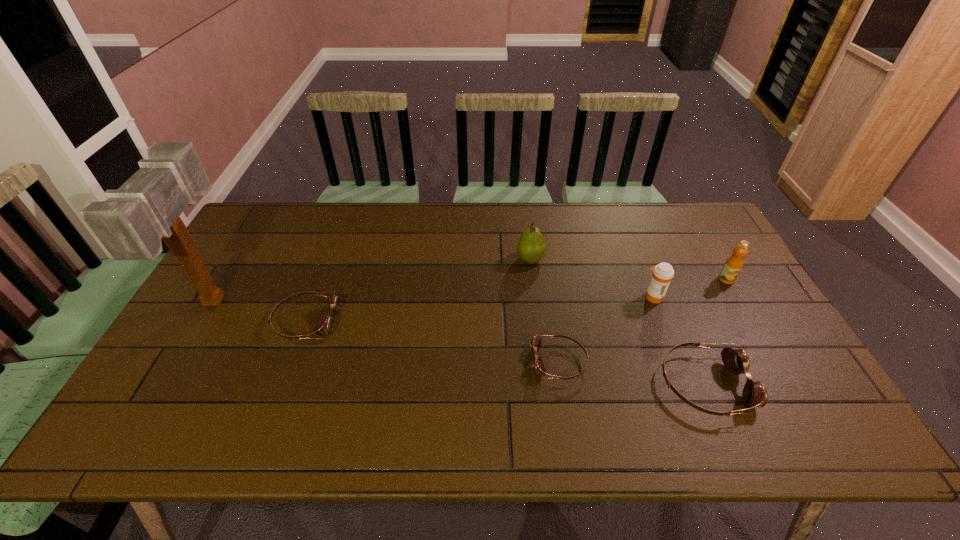
Identify the location of vacant area between the second tallest goggles and the mallet. The image size is (960, 540). (261, 310).

Locate an element on the screen. This screenshot has height=540, width=960. vacant region between the tallest object and the shortest object is located at coordinates (388, 331).

This screenshot has height=540, width=960. What are the coordinates of `vacant area that lies between the fifth tallest object and the pear` in the screenshot? It's located at (617, 322).

You are a GUI agent. You are given a task and a screenshot of the screen. Output one action in this format:
    pyautogui.click(x=<x>, y=<y>)
    Task: Click on the free spot between the orange juice and the tallest object
    
    Given the screenshot: What is the action you would take?
    pyautogui.click(x=471, y=290)

At what (x,y) coordinates should I click in order to perform the action: click on free space between the rightmost object and the medicine. Please return your answer as a coordinate pair (x, y). This screenshot has width=960, height=540. Looking at the image, I should click on (689, 288).

Identify the location of vacant point located between the second object from left to right and the pear. (419, 290).

At what (x,y) coordinates should I click in order to perform the action: click on unoccupied area between the leftmost goggles and the pear. Please return your answer as a coordinate pair (x, y). Image resolution: width=960 pixels, height=540 pixels. Looking at the image, I should click on (419, 290).

This screenshot has width=960, height=540. Find the location of `vacant space that's between the tallest object and the pear`. vacant space that's between the tallest object and the pear is located at coordinates (373, 279).

Where is `empty space that is in between the shortest object and the leftmost object`? This screenshot has height=540, width=960. empty space that is in between the shortest object and the leftmost object is located at coordinates (388, 331).

Where is `object that ranks as the sixth closest to the leftmost goggles`? object that ranks as the sixth closest to the leftmost goggles is located at coordinates [x=733, y=265].